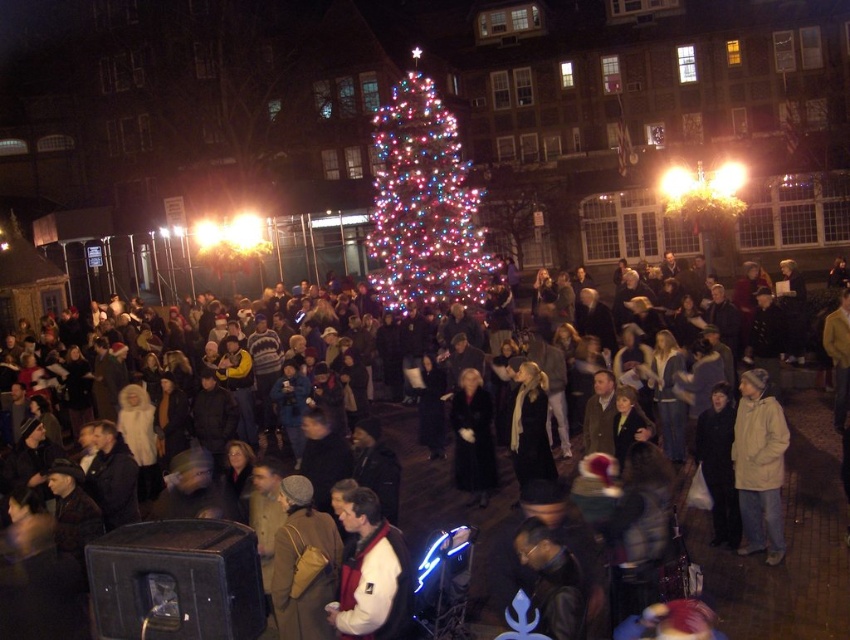
Which is above, illuminated plastic christmas tree at center or white matte coat at center?

illuminated plastic christmas tree at center is higher up.

Does illuminated plastic christmas tree at center come in front of white matte coat at center?

No, illuminated plastic christmas tree at center is further to the viewer.

Is point (411, 262) more distant than point (756, 484)?

Yes.

In order to click on illuminated plastic christmas tree at center in this screenshot , I will do `click(425, 204)`.

Is illuminated plastic christmas tree at center wider than white fleece jacket at center?

Yes.

Who is higher up, illuminated plastic christmas tree at center or white fleece jacket at center?

illuminated plastic christmas tree at center is above.

Who is more forward, (420, 275) or (384, 630)?

Positioned in front is point (384, 630).

Identify the location of illuminated plastic christmas tree at center. This screenshot has height=640, width=850. (425, 204).

Is white fleece jacket at center further to camera compared to white matte coat at center?

No, white fleece jacket at center is in front of white matte coat at center.

Is white fleece jacket at center shorter than white matte coat at center?

→ In fact, white fleece jacket at center may be taller than white matte coat at center.

Image resolution: width=850 pixels, height=640 pixels. I want to click on white fleece jacket at center, so click(x=370, y=573).